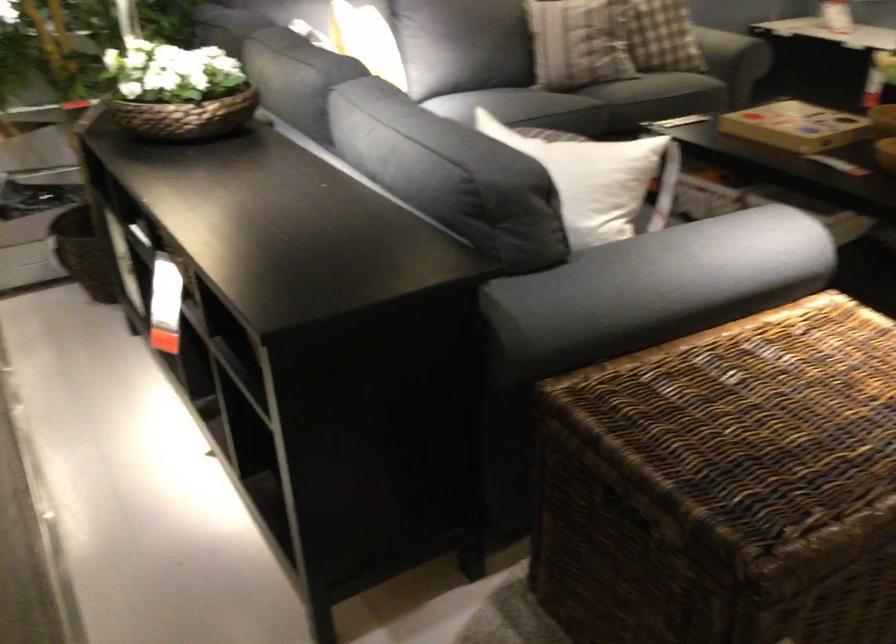
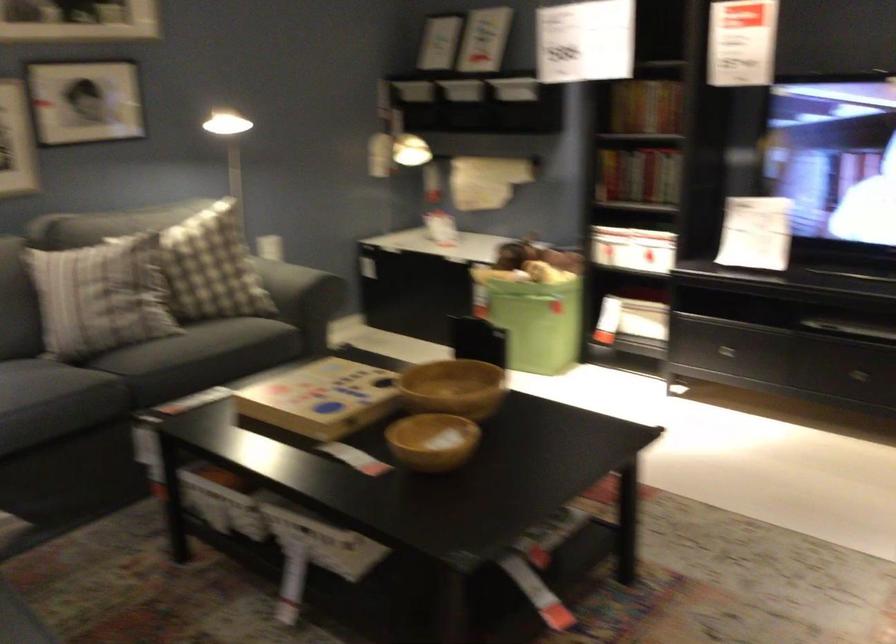
Question: The images are taken continuously from a first-person perspective. In which direction is your viewpoint rotating?

Choices:
 (A) Left
 (B) Right
 (C) Up
 (D) Down

Answer: (B)